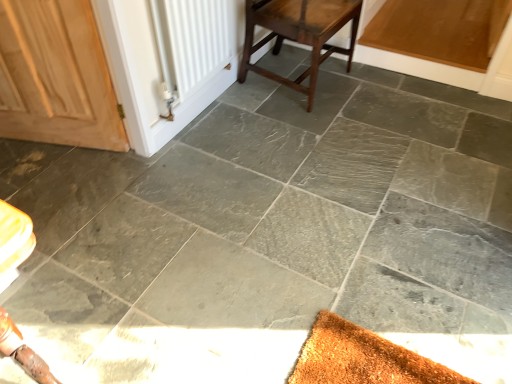
The image size is (512, 384). Identify the location of spots to the right of dark brown wood stool at center. (380, 93).